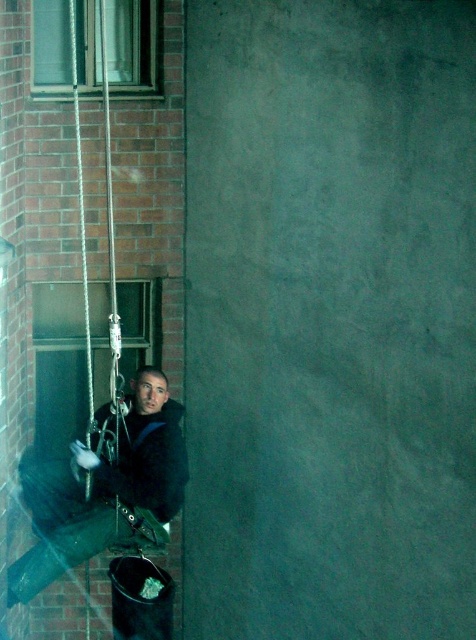
Question: Does clear glass window at center have a smaller size compared to clear glass window at upper left?

Choices:
 (A) no
 (B) yes

Answer: (A)

Question: Estimate the real-world distances between objects in this image. Which object is closer to the dark gray fabric jacket at left?

Choices:
 (A) clear glass window at center
 (B) clear glass window at upper left

Answer: (A)

Question: Can you confirm if dark gray fabric jacket at left is thinner than clear glass window at center?

Choices:
 (A) yes
 (B) no

Answer: (B)

Question: Is dark gray fabric jacket at left to the left of clear glass window at center from the viewer's perspective?

Choices:
 (A) no
 (B) yes

Answer: (A)

Question: Which of the following is the closest to the observer?

Choices:
 (A) (99, 54)
 (B) (97, 461)
 (C) (71, 307)

Answer: (B)

Question: Which object appears closest to the camera in this image?

Choices:
 (A) dark gray fabric jacket at left
 (B) clear glass window at upper left

Answer: (A)